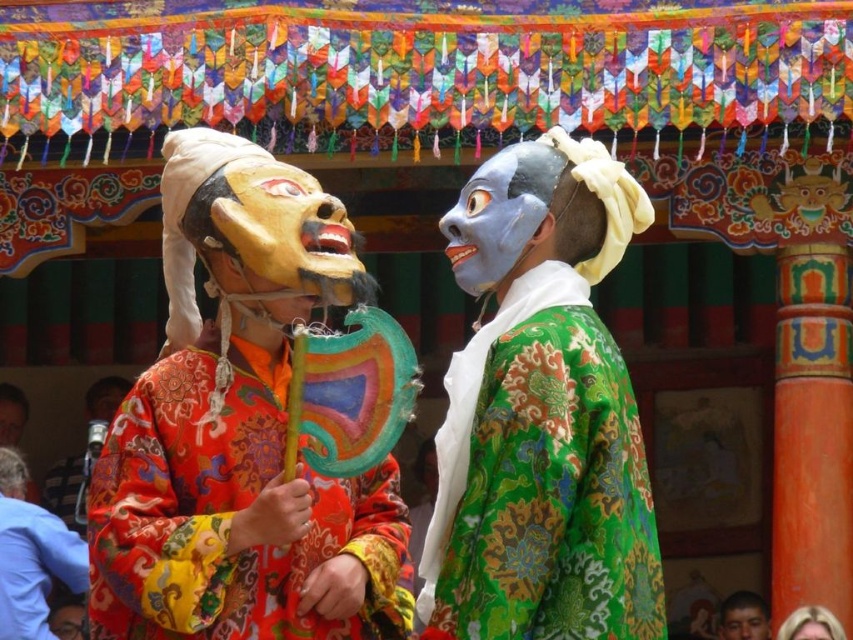
You are a photographer at a cultural performance. You need to capture a photo where both the matte orange costume at left and the matte orange mask at center are clearly visible. Based on their positions, which one should you focus on first to ensure both are in frame?

The matte orange costume at left is below the matte orange mask at center. To ensure both are in frame, focus on the matte orange mask at center first as it is higher up, allowing the camera to capture the lower positioned costume below it.

You are a photographer trying to capture the cultural performance. You notice two masks at the center of the image. Which mask would appear closer to your camera when focusing on the matte blue mask at center and the matte black mask at center?

The matte blue mask at center is in front of the matte black mask at center, so it would appear closer to your camera.